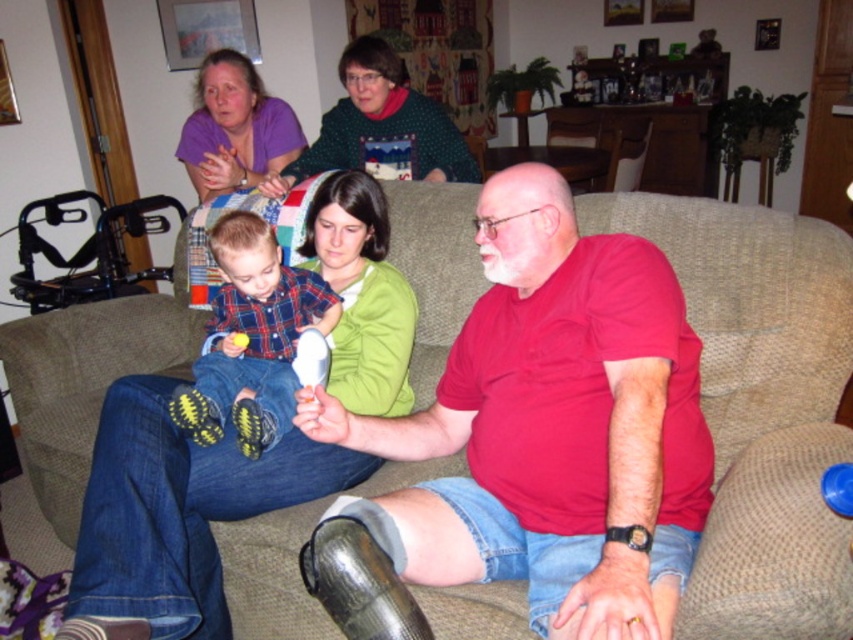
Question: Which of the following is the farthest from the observer?

Choices:
 (A) (318, 321)
 (B) (430, 186)
 (C) (398, 172)
 (D) (564, 570)

Answer: (C)

Question: Which point is closer to the camera taking this photo?

Choices:
 (A) (821, 436)
 (B) (527, 307)
 (C) (451, 157)

Answer: (A)

Question: Can you confirm if red matte shirt at center is bigger than green dotted sweater at upper center?

Choices:
 (A) no
 (B) yes

Answer: (B)

Question: Can you confirm if beige fabric couch at center is positioned to the left of green dotted sweater at upper center?

Choices:
 (A) no
 (B) yes

Answer: (B)

Question: Is beige fabric couch at center to the left of plaid fabric shirt at center from the viewer's perspective?

Choices:
 (A) no
 (B) yes

Answer: (B)

Question: Which of the following is the farthest from the observer?

Choices:
 (A) red matte shirt at center
 (B) green dotted sweater at upper center
 (C) beige fabric couch at center

Answer: (B)